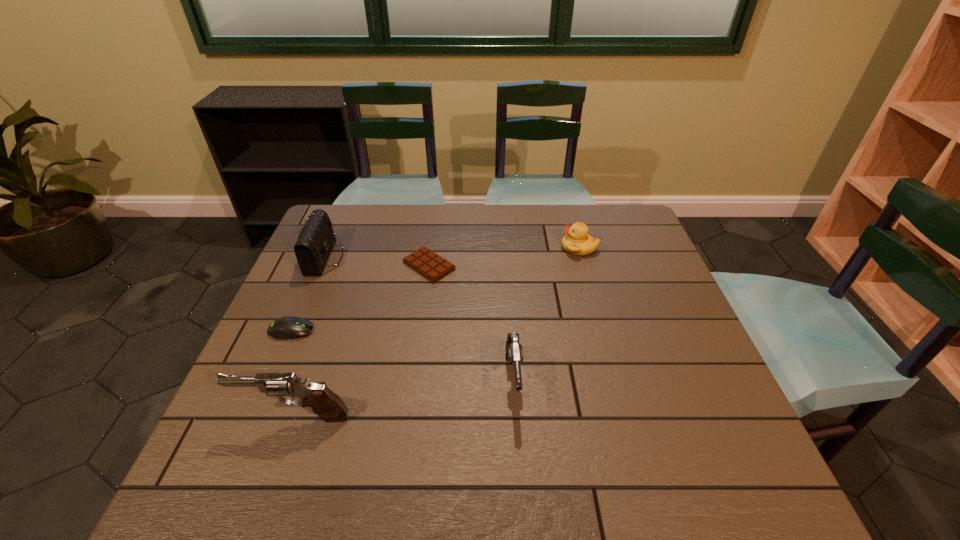
I want to click on the left pistol, so click(x=329, y=407).

The width and height of the screenshot is (960, 540). Identify the location of the tallest object. (329, 407).

Image resolution: width=960 pixels, height=540 pixels. In order to click on the right pistol in this screenshot , I will do `click(514, 351)`.

You are a GUI agent. You are given a task and a screenshot of the screen. Output one action in this format:
    pyautogui.click(x=<x>, y=<y>)
    Task: Click on the shorter pistol
    
    Given the screenshot: What is the action you would take?
    pyautogui.click(x=514, y=351)

You are a GUI agent. You are given a task and a screenshot of the screen. Output one action in this format:
    pyautogui.click(x=<x>, y=<y>)
    Task: Click on the shortest object
    The height and width of the screenshot is (540, 960).
    Given the screenshot: What is the action you would take?
    tap(424, 261)

In order to click on candy bar in this screenshot , I will do `click(424, 261)`.

Image resolution: width=960 pixels, height=540 pixels. Identify the location of clutch bag. [x=315, y=241].

This screenshot has height=540, width=960. I want to click on duckling, so click(x=577, y=241).

What are the coordinates of `the rightmost object` in the screenshot? It's located at (577, 241).

Where is `the fifth tallest object`? The height and width of the screenshot is (540, 960). the fifth tallest object is located at coordinates (285, 328).